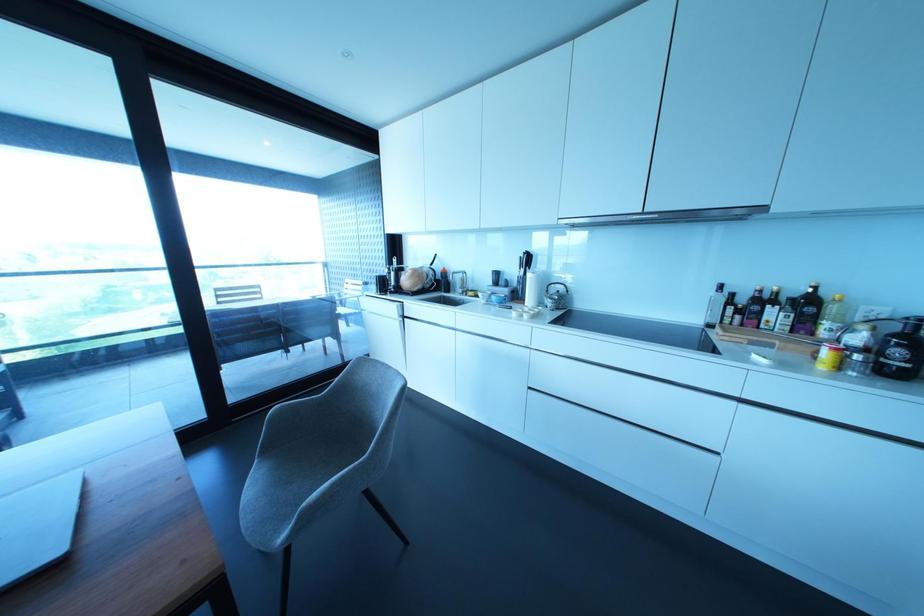
Where would you lift the patterned kettle handle? Please return your answer as a coordinate pair (x, y).

(555, 296)